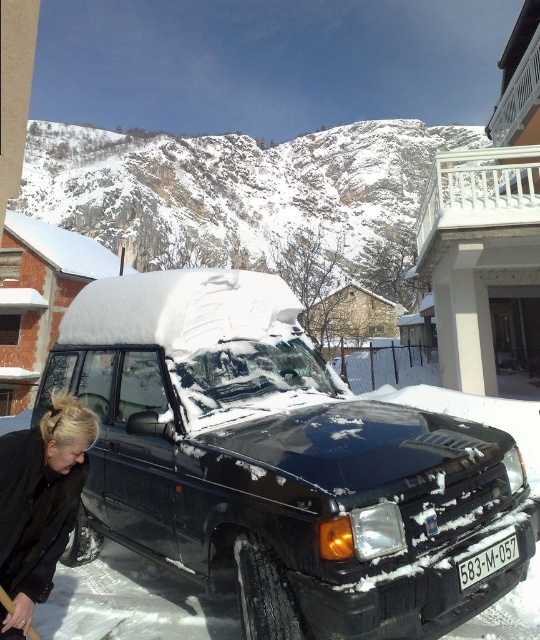
Who is more forward, (57, 452) or (487, 554)?

Point (487, 554)

This screenshot has width=540, height=640. Identify the location of blonde hair at lower left. (39, 502).

Can you confirm if black matte van at center is bigger than black plastic license plate at lower center?

Correct, black matte van at center is larger in size than black plastic license plate at lower center.

Between point (135, 333) and point (470, 564), which one is positioned in front?

Point (470, 564)

Find the location of a particular element. The height and width of the screenshot is (640, 540). black matte van at center is located at coordinates (278, 464).

Looking at this image, which is more to the left, black matte van at center or blonde hair at lower left?

blonde hair at lower left

Is black matte van at center thinner than blonde hair at lower left?

Incorrect, black matte van at center's width is not less than blonde hair at lower left's.

The width and height of the screenshot is (540, 640). What do you see at coordinates (278, 464) in the screenshot?
I see `black matte van at center` at bounding box center [278, 464].

Find the location of a particular element. The height and width of the screenshot is (640, 540). black matte van at center is located at coordinates (278, 464).